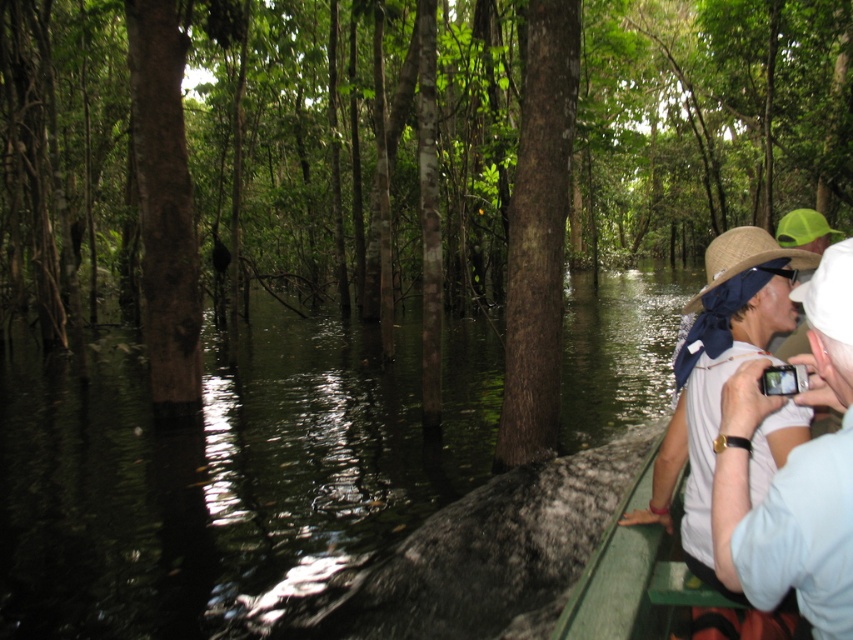
Question: Does brown rough tree at center have a greater width compared to light brown straw hat at right?

Choices:
 (A) yes
 (B) no

Answer: (A)

Question: Observing the image, what is the correct spatial positioning of brown rough tree trunk at center in reference to white cotton shirt at right?

Choices:
 (A) above
 (B) below

Answer: (A)

Question: Can you confirm if greenish-brown water at center is positioned below light brown straw hat at right?

Choices:
 (A) no
 (B) yes

Answer: (B)

Question: Which point appears closest to the camera in this image?

Choices:
 (A) (569, 45)
 (B) (793, 548)
 (C) (700, 412)

Answer: (B)

Question: Among these objects, which one is nearest to the camera?

Choices:
 (A) greenish-brown water at center
 (B) white cotton shirt at right

Answer: (B)

Question: Among these points, which one is farthest from the camera?

Choices:
 (A) (61, 536)
 (B) (527, 365)

Answer: (B)